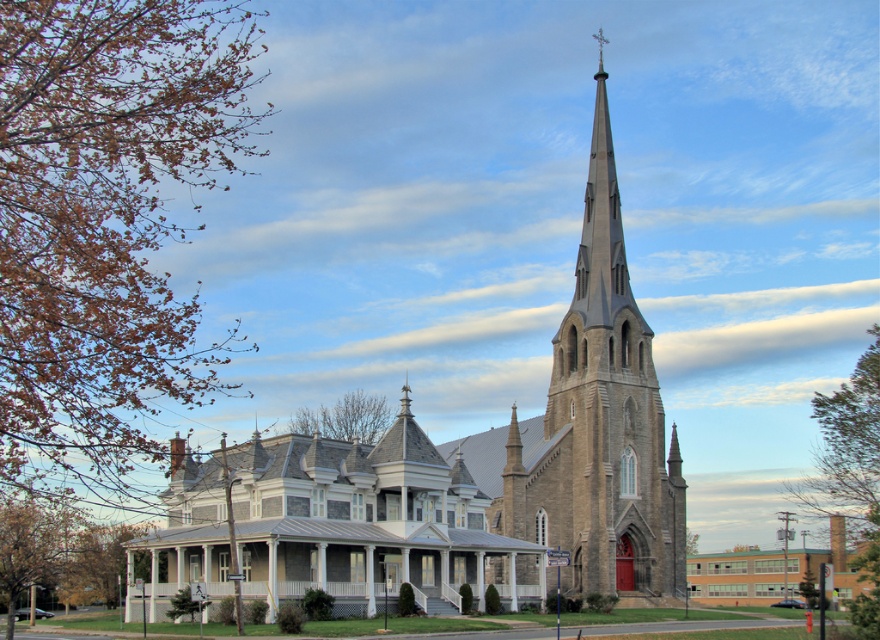
From the picture: You are an architect evaluating the design of the church and its adjacent building. Based on the image, which object has a greater width between the stone steeple at center and the gray stone church at center?

The stone steeple at center has a larger width than the gray stone church at center according to the description.

You are standing at point (495, 467) in the scene. What object is located exactly at that point?

The stone steeple at center is located exactly at point (495, 467).